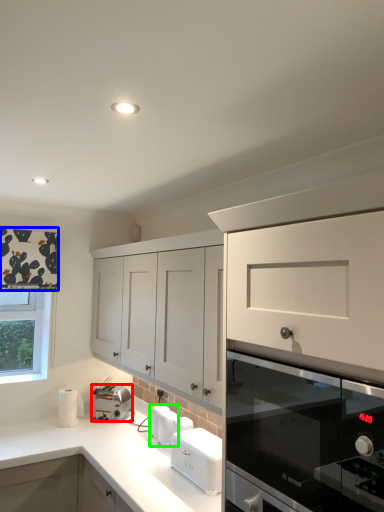
Question: Considering the real-world distances, which object is farthest from kitchen appliance (highlighted by a red box)? curtain (highlighted by a blue box) or appliance (highlighted by a green box)?

Choices:
 (A) curtain
 (B) appliance

Answer: (A)